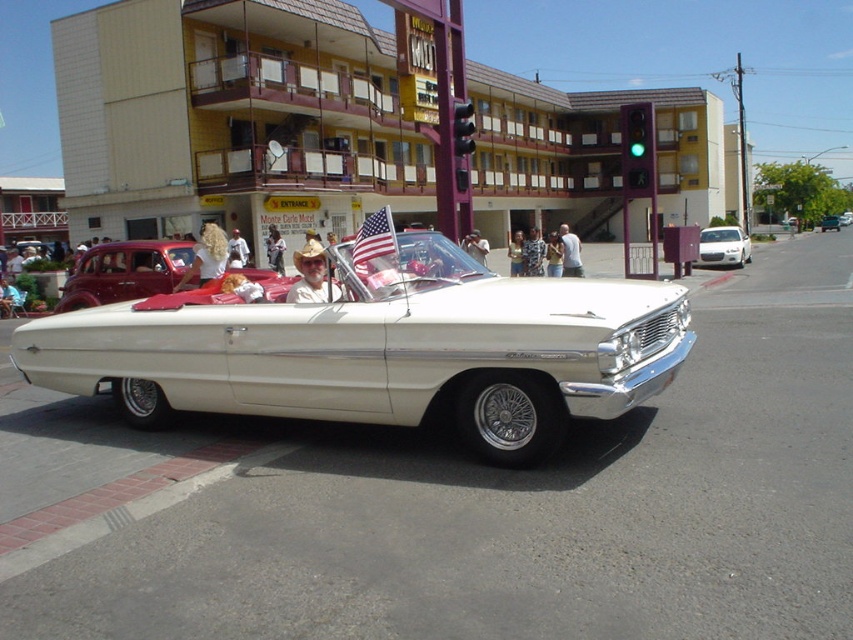
Locate an element on the screen. The width and height of the screenshot is (853, 640). white metallic convertible at center is located at coordinates (383, 349).

Is white metallic convertible at center behind american flag at center?

No, it is in front of american flag at center.

Between point (537, 326) and point (352, 250), which one is positioned in front?

Point (537, 326) is in front.

Find the location of `white metallic convertible at center`. white metallic convertible at center is located at coordinates (383, 349).

Is white metallic sedan at center below american flag at center?

Incorrect, white metallic sedan at center is not positioned below american flag at center.

Looking at this image, does white metallic sedan at center have a lesser width compared to american flag at center?

Incorrect, white metallic sedan at center's width is not less than american flag at center's.

This screenshot has width=853, height=640. What do you see at coordinates (723, 246) in the screenshot?
I see `white metallic sedan at center` at bounding box center [723, 246].

Where is `white metallic sedan at center`? white metallic sedan at center is located at coordinates (723, 246).

From the picture: Measure the distance from white metallic sedan at center to metallic silver convertible at center.

They are 63.46 meters apart.

Who is more distant from viewer, [732,228] or [825,216]?

Point [825,216]

Where is `white metallic sedan at center`? Image resolution: width=853 pixels, height=640 pixels. white metallic sedan at center is located at coordinates (723, 246).